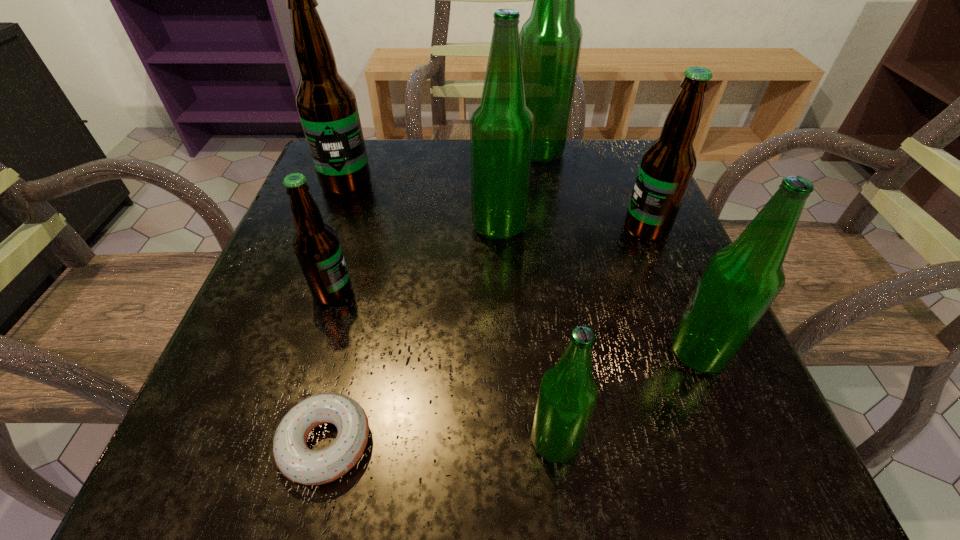
Where is `vacant space located on the label of the second farthest object`? vacant space located on the label of the second farthest object is located at coordinates (307, 291).

This screenshot has height=540, width=960. I want to click on blank space located on the label of the second farthest brown beer bottle, so click(x=432, y=229).

You are a GUI agent. You are given a task and a screenshot of the screen. Output one action in this format:
    pyautogui.click(x=<x>, y=<y>)
    Task: Click on the free region located on the label of the second farthest brown beer bottle
    
    Given the screenshot: What is the action you would take?
    pyautogui.click(x=484, y=229)

Where is `vacant space located on the label of the second farthest brown beer bottle`? This screenshot has height=540, width=960. vacant space located on the label of the second farthest brown beer bottle is located at coordinates pos(437,229).

This screenshot has height=540, width=960. In order to click on free spot located on the label of the third farthest green beer bottle in this screenshot , I will do `click(528, 354)`.

The width and height of the screenshot is (960, 540). I want to click on free point located 0.230m on the label of the third farthest green beer bottle, so click(x=515, y=354).

The height and width of the screenshot is (540, 960). What are the coordinates of `vacant space positioned 0.210m on the label of the third farthest green beer bottle` in the screenshot? It's located at (528, 354).

This screenshot has height=540, width=960. What are the coordinates of `free space located on the label of the smallest brown beer bottle` in the screenshot? It's located at (532, 293).

Find the location of a particular element. The width and height of the screenshot is (960, 540). vacant space located 0.060m on the label of the nearest green beer bottle is located at coordinates (483, 442).

Locate an element on the screen. This screenshot has height=540, width=960. vacant point located on the label of the nearest green beer bottle is located at coordinates (333, 442).